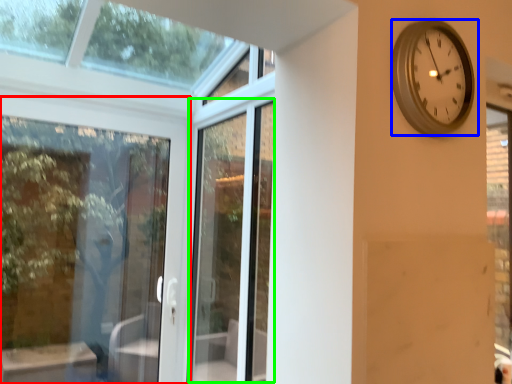
Question: Which is farther away from door (highlighted by a red box)? wall clock (highlighted by a blue box) or screen door (highlighted by a green box)?

Choices:
 (A) wall clock
 (B) screen door

Answer: (A)